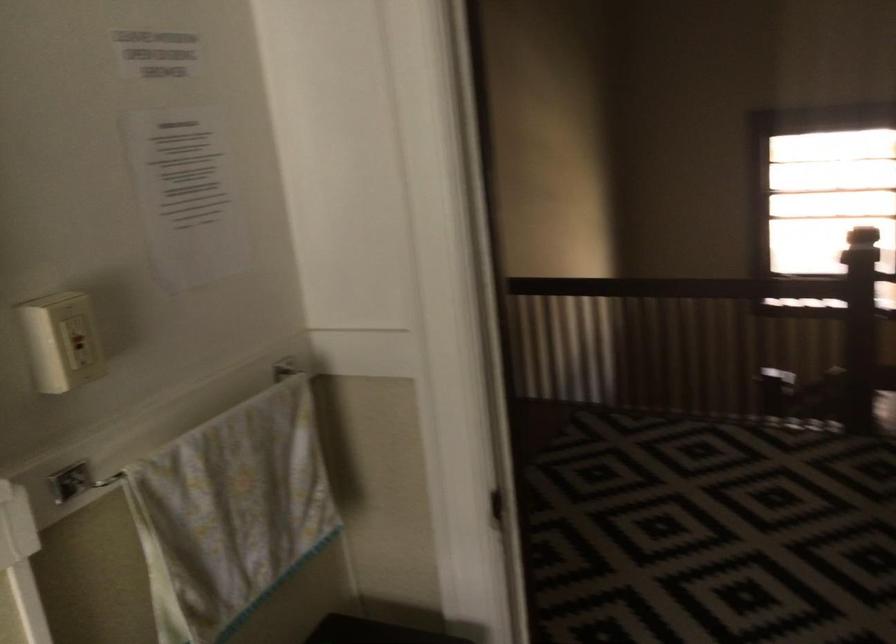
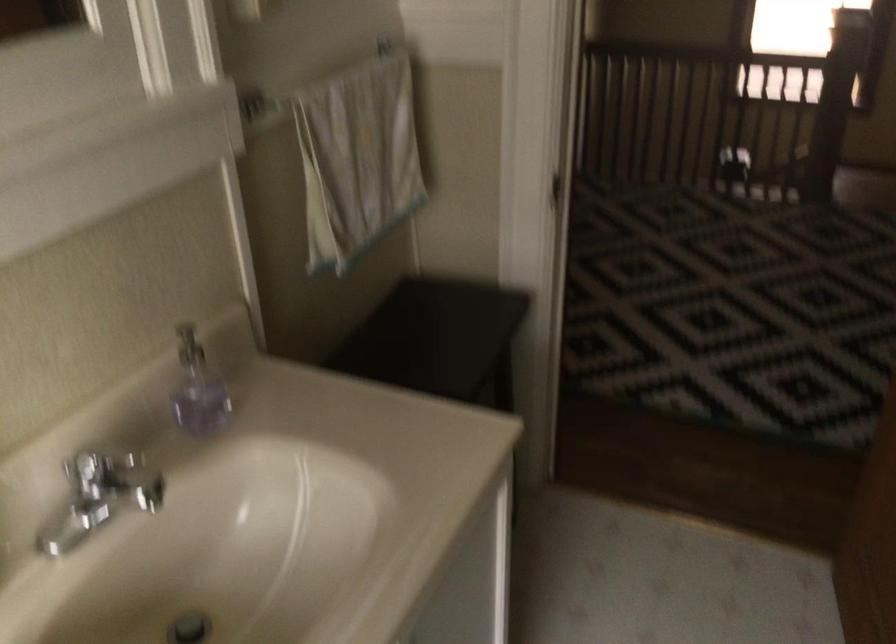
The point at (230, 505) is marked in the first image. Where is the corresponding point in the second image?

(357, 158)